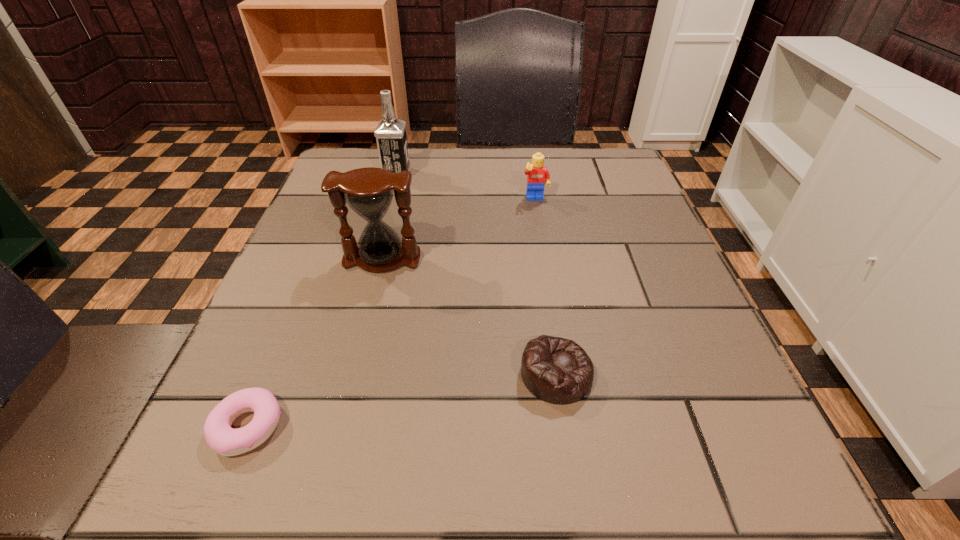
Locate an element on the screen. free location located 0.220m on the back of the beanbag is located at coordinates (539, 255).

Identify the location of vacant space situated on the back of the leftmost object. (302, 296).

This screenshot has height=540, width=960. Find the location of `vodka situated at the far edge`. vodka situated at the far edge is located at coordinates (390, 133).

At what (x,y) coordinates should I click in order to perform the action: click on Lego at the far edge. Please return your answer as a coordinate pair (x, y). The height and width of the screenshot is (540, 960). Looking at the image, I should click on (537, 173).

Find the location of `object at the near edge`. object at the near edge is located at coordinates point(226,441).

This screenshot has width=960, height=540. Identify the location of vodka present at the left edge. (390, 133).

In order to click on hourglass at the left edge in this screenshot , I will do `click(369, 192)`.

Where is `pastry at the left edge`? The height and width of the screenshot is (540, 960). pastry at the left edge is located at coordinates pos(226,441).

Identify the location of object positioned at the far left corner. click(x=390, y=133).

At what (x,y) coordinates should I click in order to perform the action: click on object present at the near left corner. Please return your answer as a coordinate pair (x, y). Looking at the image, I should click on (226, 441).